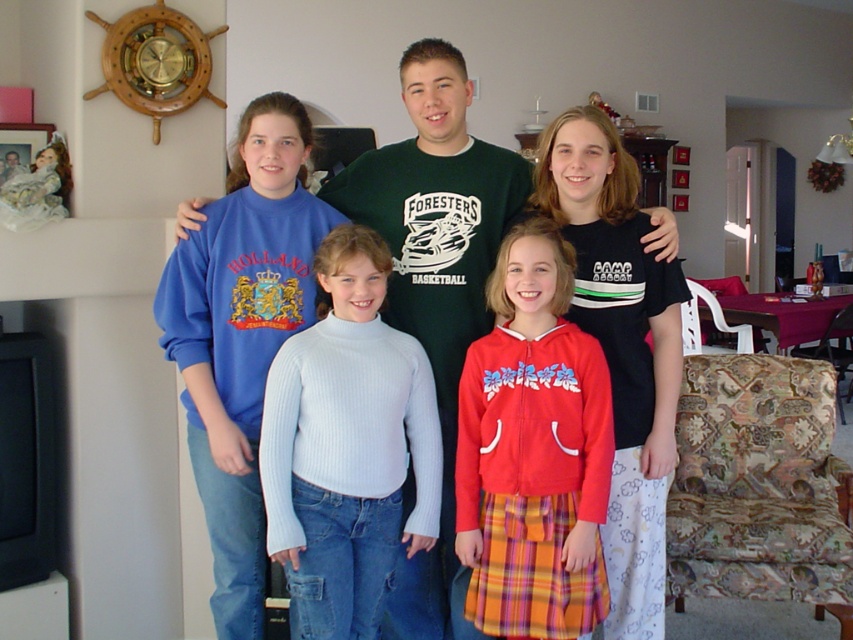
Can you confirm if white ribbed sweater at center is positioned to the right of red fleece jacket at center?

Incorrect, white ribbed sweater at center is not on the right side of red fleece jacket at center.

This screenshot has height=640, width=853. Describe the element at coordinates (347, 448) in the screenshot. I see `white ribbed sweater at center` at that location.

Locate an element on the screen. Image resolution: width=853 pixels, height=640 pixels. white ribbed sweater at center is located at coordinates (347, 448).

Between white ribbed sweater at center and matte blue sweatshirt at upper left, which one has less height?

With less height is matte blue sweatshirt at upper left.

Which is more to the left, white ribbed sweater at center or matte blue sweatshirt at upper left?

From the viewer's perspective, white ribbed sweater at center appears more on the left side.

Image resolution: width=853 pixels, height=640 pixels. What do you see at coordinates (347, 448) in the screenshot? I see `white ribbed sweater at center` at bounding box center [347, 448].

I want to click on white ribbed sweater at center, so click(x=347, y=448).

Is red fleece jacket at center further to the viewer compared to matte blue sweatshirt at upper left?

No, it is in front of matte blue sweatshirt at upper left.

Is red fleece jacket at center positioned before matte blue sweatshirt at upper left?

Yes, red fleece jacket at center is closer to the viewer.

Locate an element on the screen. This screenshot has width=853, height=640. red fleece jacket at center is located at coordinates (532, 451).